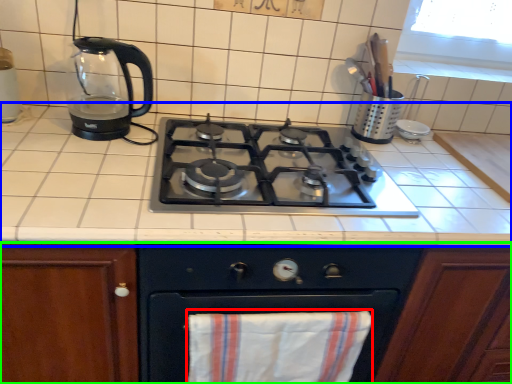
Question: Considering the real-world distances, which object is farthest from beach towel (highlighted by a red box)? countertop (highlighted by a blue box) or cabinetry (highlighted by a green box)?

Choices:
 (A) countertop
 (B) cabinetry

Answer: (A)